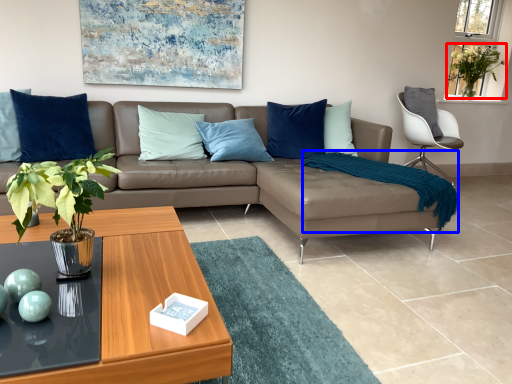
Question: Which object appears farthest to the camera in this image, plant (highlighted by a red box) or blanket (highlighted by a blue box)?

Choices:
 (A) plant
 (B) blanket

Answer: (A)